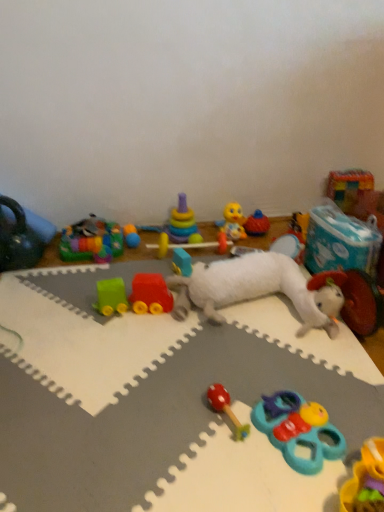
Identify the location of free space between smooth red wooden rattle at center, which ranks as the 7th toy in left-to-right order, and rubber block at center, which is the fifth toy in left-to-right order. (207, 348).